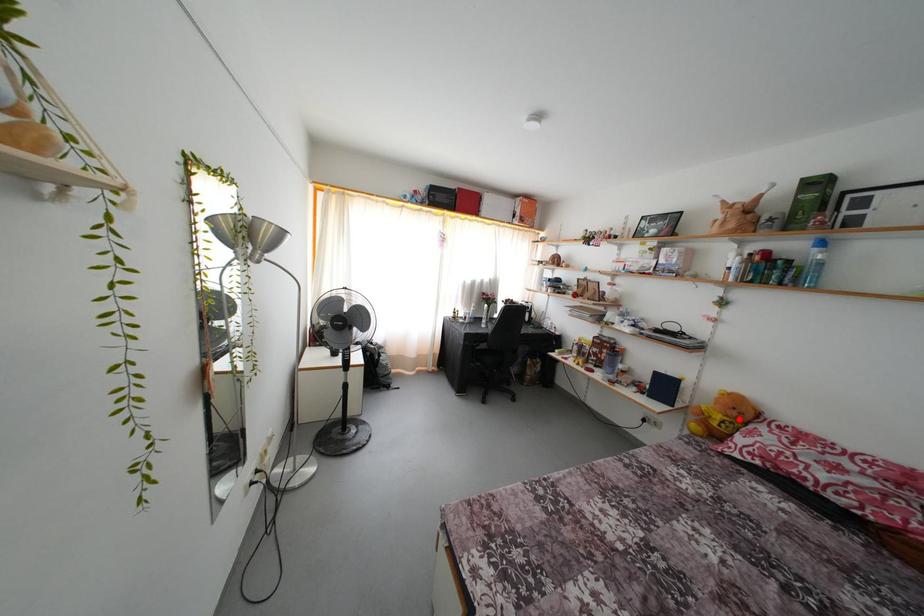
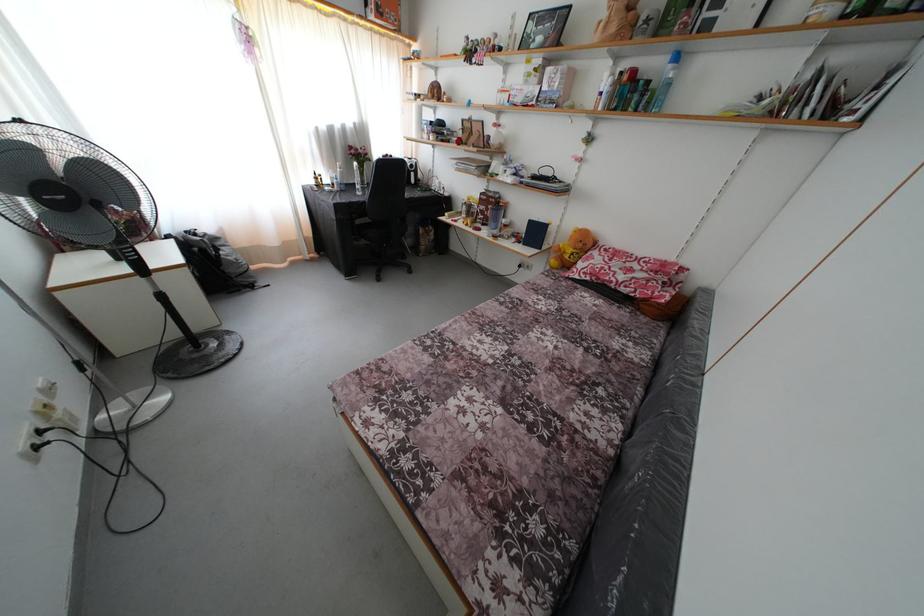
Find the pixel in the second image that matches the highlighted location in the first image.

(585, 251)